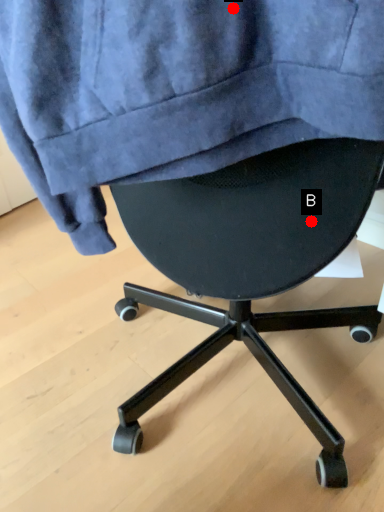
Question: Two points are circled on the image, labeled by A and B beside each circle. Which of the following is the closest to the observer?

Choices:
 (A) A is closer
 (B) B is closer

Answer: (A)